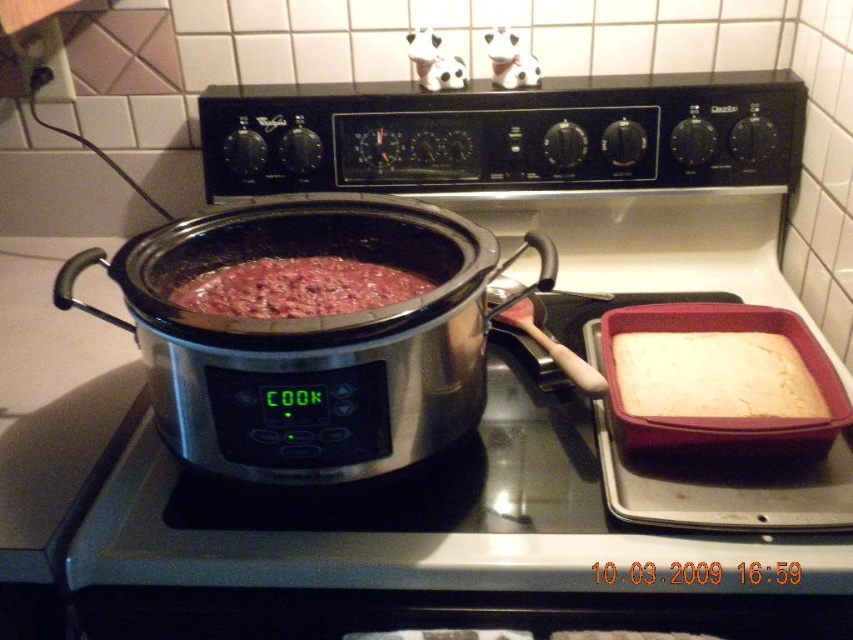
Question: Where is stainless steel slow cooker at center located in relation to stainless steel crock pot at center in the image?

Choices:
 (A) below
 (B) above

Answer: (A)

Question: Considering the real-world distances, which object is farthest from the stainless steel crock pot at center?

Choices:
 (A) white fluffy cake at right
 (B) brown matte pot at center

Answer: (A)

Question: Among these objects, which one is farthest from the camera?

Choices:
 (A) stainless steel slow cooker at center
 (B) stainless steel crock pot at center
 (C) brown matte pot at center

Answer: (C)

Question: Which of the following is the farthest from the observer?

Choices:
 (A) stainless steel crock pot at center
 (B) stainless steel slow cooker at center
 (C) brown matte pot at center
 (D) white fluffy cake at right

Answer: (C)

Question: Can you confirm if white fluffy cake at right is positioned above brown matte pot at center?

Choices:
 (A) no
 (B) yes

Answer: (A)

Question: Does white fluffy cake at right lie in front of brown matte pot at center?

Choices:
 (A) no
 (B) yes

Answer: (B)